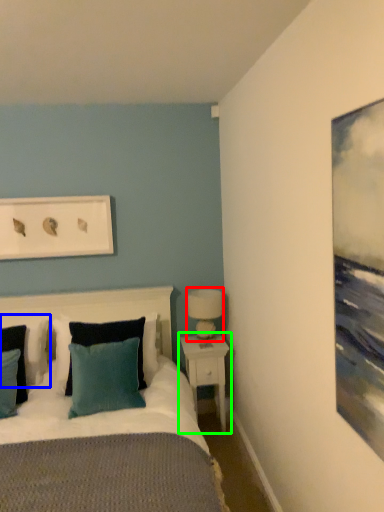
Question: Based on their relative distances, which object is nearer to table lamp (highlighted by a red box)? Choose from pillow (highlighted by a blue box) and nightstand (highlighted by a green box).

Choices:
 (A) pillow
 (B) nightstand

Answer: (B)